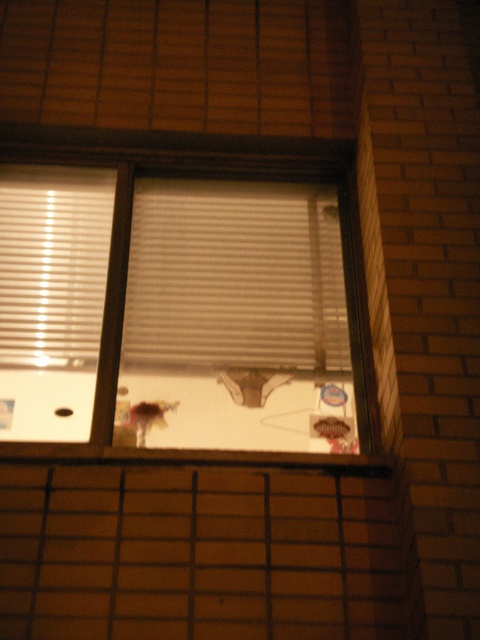
How much distance is there between white matte blinds at center and white matte blinds at left?

The distance of white matte blinds at center from white matte blinds at left is 14.11 inches.

The height and width of the screenshot is (640, 480). Describe the element at coordinates (235, 276) in the screenshot. I see `white matte blinds at center` at that location.

Is point (250, 330) positioned before point (17, 188)?

Yes.

At what (x,y) coordinates should I click in order to perform the action: click on white matte blinds at center. Please return your answer as a coordinate pair (x, y). This screenshot has width=480, height=640. Looking at the image, I should click on (235, 276).

Consider the image. Can you confirm if white matte blinds at center is taller than smooth wood window sill at center?

Correct, white matte blinds at center is much taller as smooth wood window sill at center.

The image size is (480, 640). I want to click on white matte blinds at center, so click(235, 276).

Which is above, white matte window at center or white matte blinds at left?

white matte blinds at left is higher up.

This screenshot has height=640, width=480. Identify the location of white matte window at center. (180, 298).